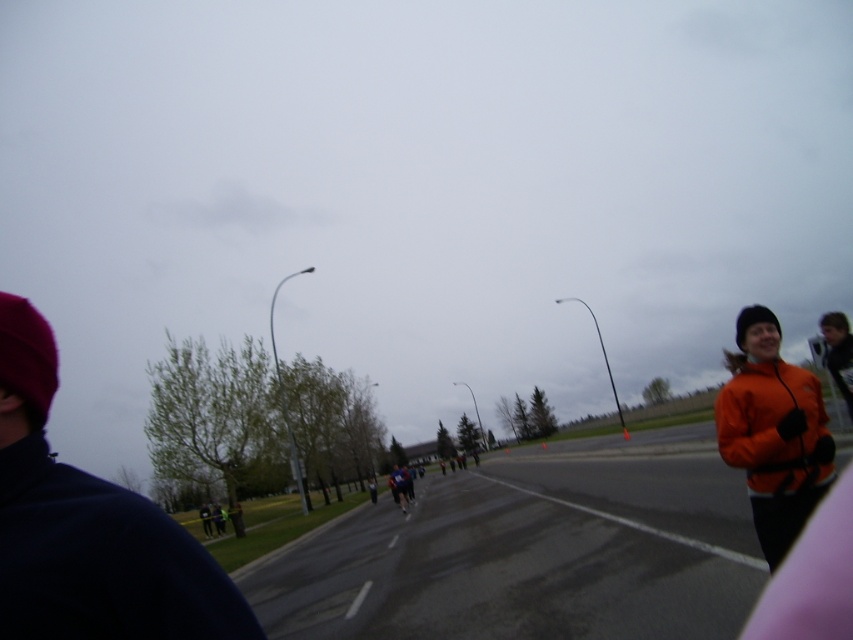
You are a photographer standing at the starting line of the marathon. You want to take a photo that includes both the dark blue jacket at left and orange fleece jacket at right. Which jacket should you adjust your camera angle to focus on first to ensure both are in frame?

The dark blue jacket at left is positioned over the orange fleece jacket at right, so you should focus on the dark blue jacket at left first to ensure both are visible in the photo.

You are a photographer positioned at the center of the road. You see the orange fleece jacket at right and the orange jacket at right in your viewfinder. Which one appears taller in the photo?

The orange fleece jacket at right is not as tall as the orange jacket at right, so the orange jacket at right appears taller in the photo.